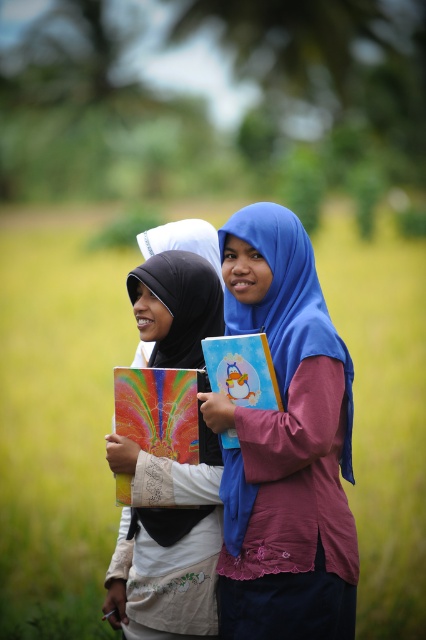
Question: Is rainbow matte coloring book at center above matte paper coloring book at center?

Choices:
 (A) yes
 (B) no

Answer: (B)

Question: Which object is farther from the camera taking this photo?

Choices:
 (A) matte blue hijab at center
 (B) matte paper coloring book at center

Answer: (B)

Question: Can you confirm if matte blue hijab at center is thinner than matte paper coloring book at center?

Choices:
 (A) no
 (B) yes

Answer: (A)

Question: Is matte blue hijab at center below matte black hijab at left?

Choices:
 (A) no
 (B) yes

Answer: (A)

Question: Among these points, which one is nearest to the camera?

Choices:
 (A) (262, 552)
 (B) (207, 604)
 (C) (190, 454)
 (D) (233, 435)

Answer: (A)

Question: Which point appears closest to the camera in this image?

Choices:
 (A) (325, 344)
 (B) (206, 356)
 (C) (163, 404)
 (D) (184, 465)

Answer: (A)